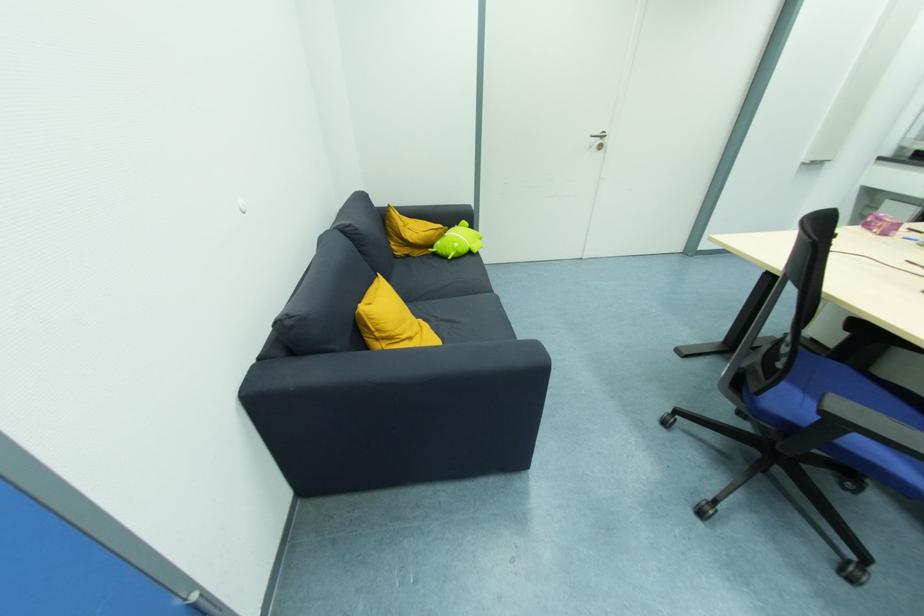
Where is `green stuffed toy`? The width and height of the screenshot is (924, 616). green stuffed toy is located at coordinates (457, 241).